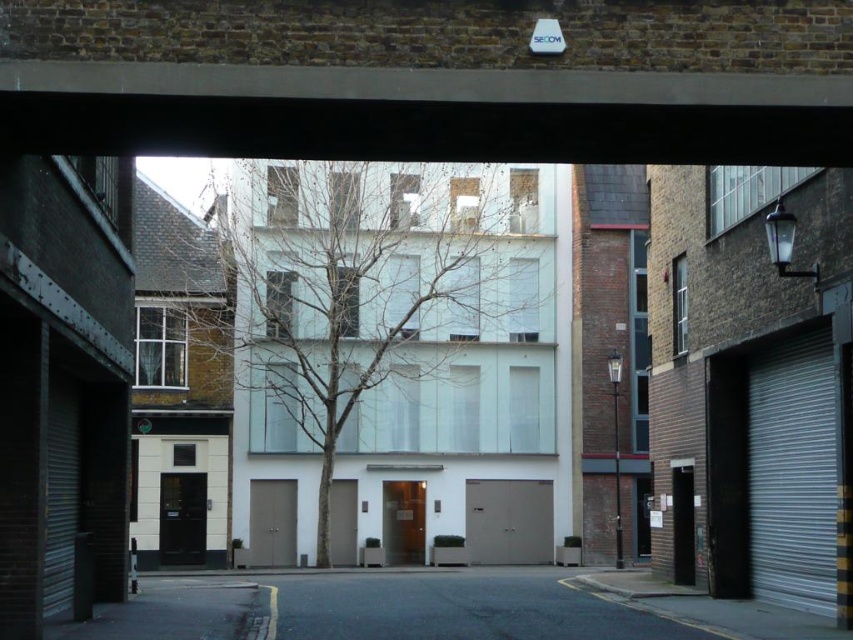
You are standing in an urban underpass and want to reach the concrete at upper center. Given that you can only move forward in a straight line, will you be able to reach it without any obstacles?

The concrete at upper center is 32.36 feet away from you, so if there are no obstacles in your path, you can reach it by moving forward in a straight line for that distance.

You are a delivery person trying to navigate through the narrow underpass. You need to know if the concrete at upper center is taller than the metallic gray garage door at center to avoid hitting your delivery van. Can you tell me which one is taller?

The metallic gray garage door at center is taller than the concrete at upper center, so the delivery van should be able to pass under the concrete at upper center without hitting it.

You are a delivery person trying to navigate through the narrow underpass shown in the image. You need to ensure your delivery truck, which is 3 meters wide, can pass through the space between the concrete at upper center and the metallic gray garage door at center. Can you confirm if the space between them is wide enough for your truck?

The concrete at upper center is wider than the metallic gray garage door at center, but the width comparison alone does not provide exact measurements. Without knowing the actual width of the space between them, it is impossible to determine if the truck can pass through safely. Please check the exact dimensions or consult a map for accurate clearance information.